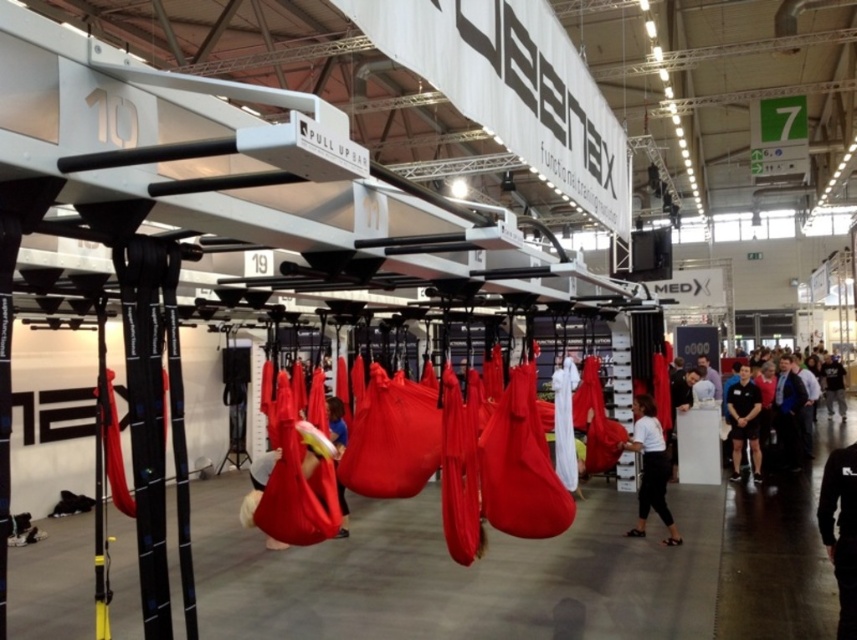
Question: Which point appears closest to the camera in this image?

Choices:
 (A) (333, 435)
 (B) (838, 465)

Answer: (B)

Question: Which of the following is the closest to the observer?

Choices:
 (A) white matte shirt at center
 (B) black fabric pants at lower right

Answer: (B)

Question: Is black fabric pants at lower right smaller than white matte shirt at center?

Choices:
 (A) yes
 (B) no

Answer: (A)

Question: Based on their relative distances, which object is nearer to the white matte shirt at center?

Choices:
 (A) blue fabric at center
 (B) black fabric pants at lower right

Answer: (B)

Question: Can you confirm if black fabric pants at lower right is bigger than white matte shirt at center?

Choices:
 (A) yes
 (B) no

Answer: (B)

Question: Can you confirm if white matte shirt at center is positioned below blue fabric at center?

Choices:
 (A) no
 (B) yes

Answer: (B)